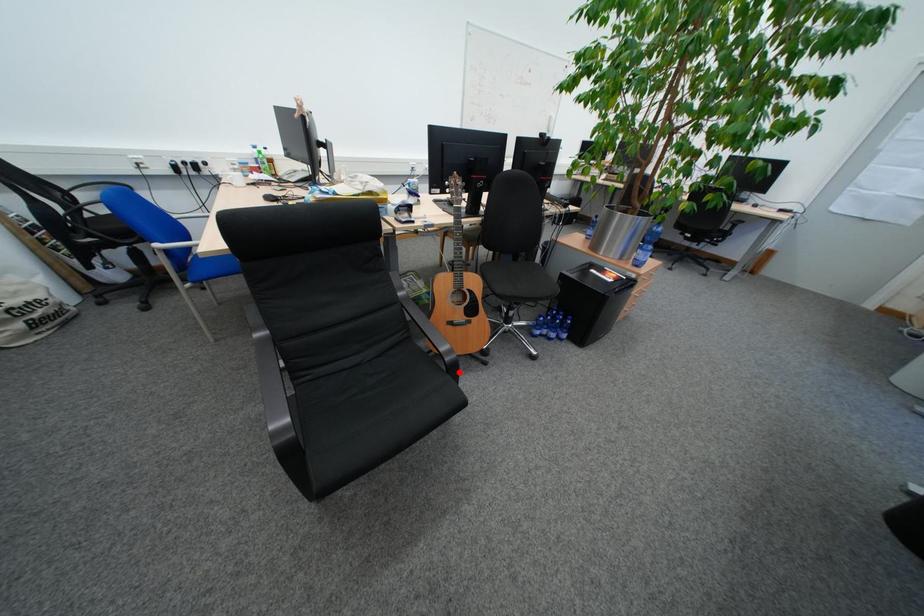
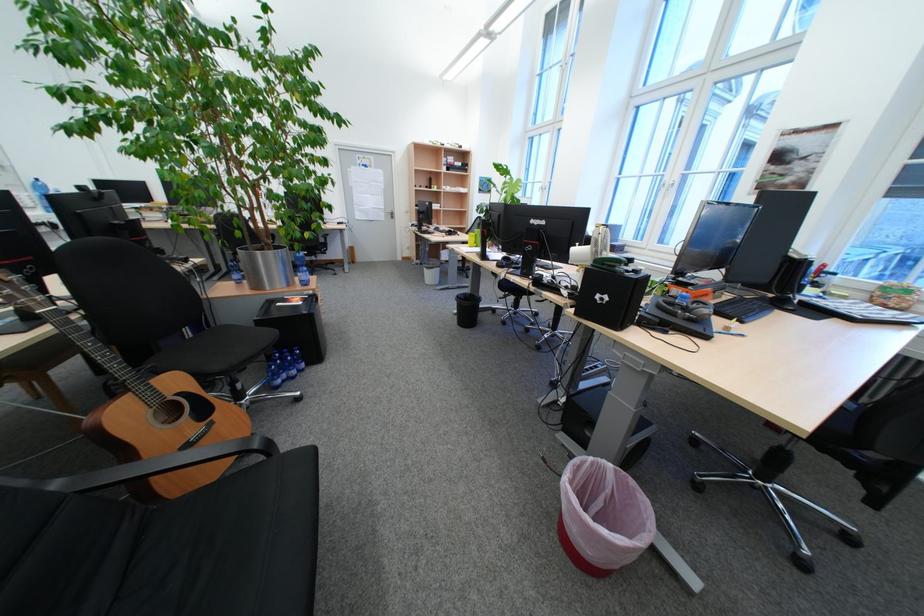
The point at the highlighted location is marked in the first image. Where is the corresponding point in the second image?

(281, 456)